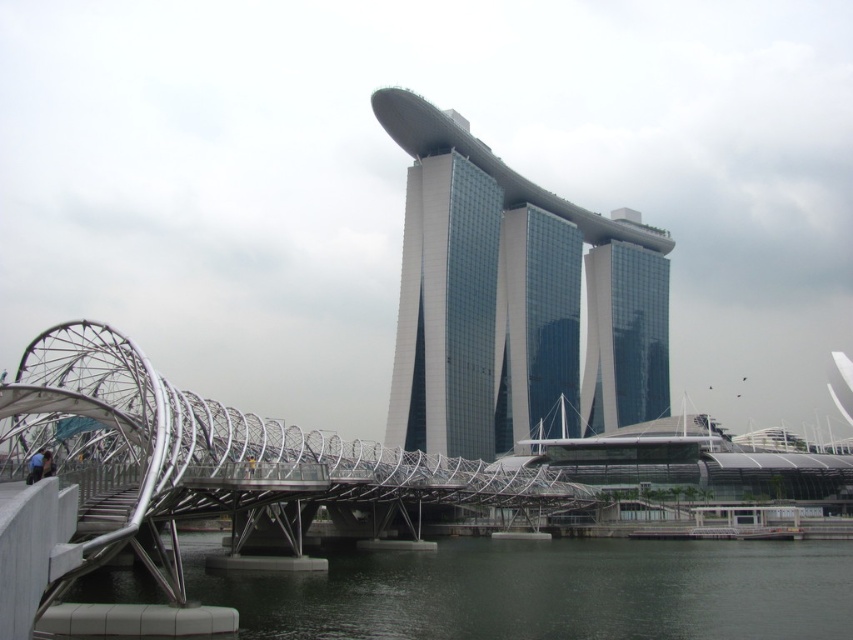
Who is taller, glassy steel skyscraper at center or glassy steel tower at center?

glassy steel skyscraper at center

Can you confirm if glassy steel skyscraper at center is smaller than glassy steel tower at center?

→ Actually, glassy steel skyscraper at center might be larger than glassy steel tower at center.

Locate an element on the screen. The image size is (853, 640). glassy steel skyscraper at center is located at coordinates (514, 300).

This screenshot has width=853, height=640. I want to click on glassy steel skyscraper at center, so click(x=514, y=300).

Is dark gray water at lower center to the right of glassy reflective skyscraper at center from the viewer's perspective?

In fact, dark gray water at lower center is to the left of glassy reflective skyscraper at center.

Does dark gray water at lower center appear over glassy reflective skyscraper at center?

No, dark gray water at lower center is not above glassy reflective skyscraper at center.

Measure the distance between dark gray water at lower center and camera.

dark gray water at lower center is 38.20 meters away from camera.

The height and width of the screenshot is (640, 853). What are the coordinates of `dark gray water at lower center` in the screenshot? It's located at (547, 592).

At what (x,y) coordinates should I click in order to perform the action: click on metallic silver bridge at lower left. Please return your answer as a coordinate pair (x, y). Looking at the image, I should click on (212, 460).

Does metallic silver bridge at lower left have a smaller size compared to glassy steel tower at center?

No, metallic silver bridge at lower left is not smaller than glassy steel tower at center.

Which is in front, point (79, 556) or point (498, 440)?

Point (79, 556) is in front.

This screenshot has height=640, width=853. What are the coordinates of `metallic silver bridge at lower left` in the screenshot? It's located at (212, 460).